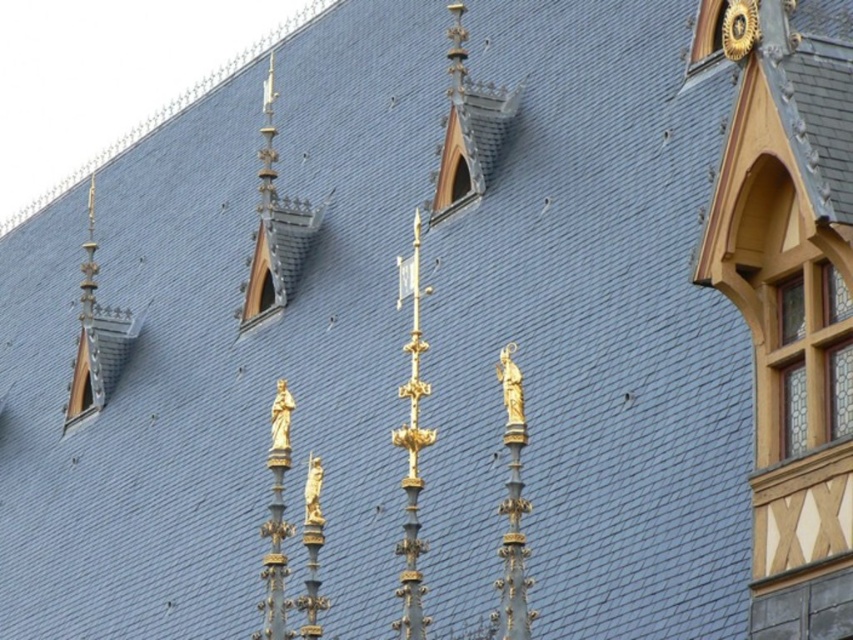
You are an architect examining the roof structure. You need to install a new weather vane that requires a mounting height of at least 1 meter. Given the transparent glass window at upper center and the gold metallic clock at upper right, which object can accommodate the weather vane based on their height?

The transparent glass window at upper center has a greater height compared to the gold metallic clock at upper right, so the transparent glass window at upper center can accommodate the weather vane since it meets the required height of at least 1 meter.

You are an architect assessing the roof of a historical building. You notice the stained glass window at upper right and the gold metallic clock at upper right. Which object has a greater width?

The stained glass window at upper right has a greater width than the gold metallic clock at upper right.